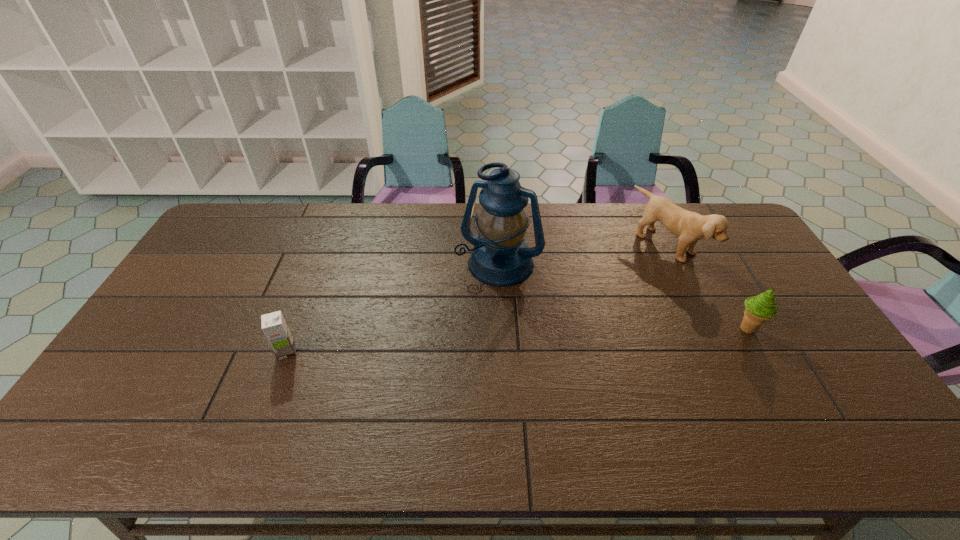
Locate an element on the screen. This screenshot has width=960, height=540. free area in between the second object from left to right and the leftmost object is located at coordinates (393, 308).

Where is `free point between the leftmost object and the puppy`? free point between the leftmost object and the puppy is located at coordinates (478, 299).

The image size is (960, 540). Find the location of `vacant space in between the icecream and the puppy`. vacant space in between the icecream and the puppy is located at coordinates (708, 287).

Choose which object is the nearest neighbor to the lantern. Please provide its 2D coordinates. Your answer should be formatted as a tuple, i.e. [(x, y)], where the tuple contains the x and y coordinates of a point satisfying the conditions above.

[(690, 227)]

In order to click on object that is the second nearest to the nearest object in this screenshot , I will do `click(690, 227)`.